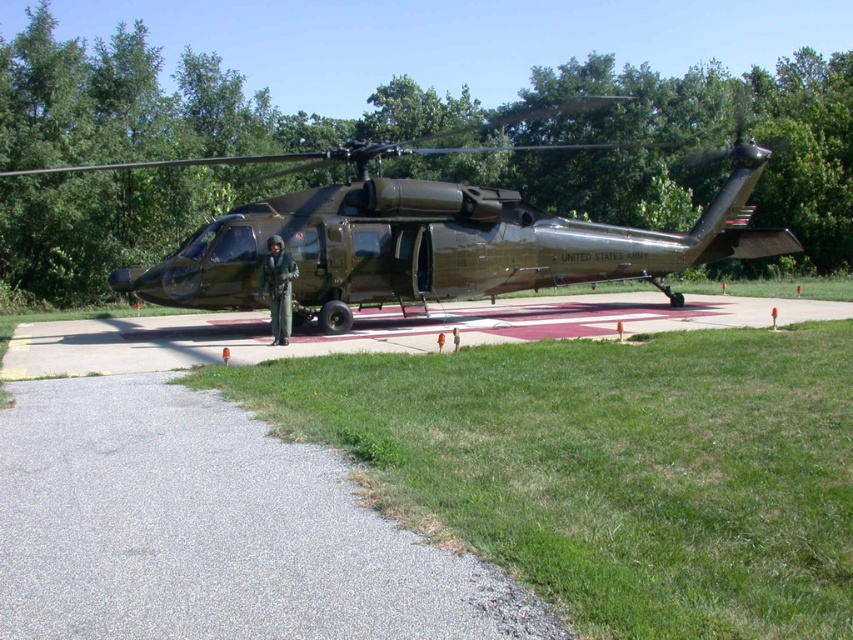
Who is taller, gray asphalt tarmac at lower left or matte black helicopter at center?

matte black helicopter at center is taller.

What do you see at coordinates (212, 531) in the screenshot? The image size is (853, 640). I see `gray asphalt tarmac at lower left` at bounding box center [212, 531].

In order to click on gray asphalt tarmac at lower left in this screenshot , I will do `click(212, 531)`.

Which of these two, gray asphalt tarmac at lower left or camouflage fabric uniform at center, stands shorter?

With less height is gray asphalt tarmac at lower left.

Does point (303, 588) come closer to viewer compared to point (277, 282)?

Yes.

Where is `gray asphalt tarmac at lower left`? gray asphalt tarmac at lower left is located at coordinates (212, 531).

Is point (706, 156) positioned after point (721, 300)?

That is True.

Consider the image. Is matte black helicopter at center bigger than concrete tarmac at center?

Correct, matte black helicopter at center is larger in size than concrete tarmac at center.

At what (x,y) coordinates should I click in order to perform the action: click on matte black helicopter at center. Please return your answer as a coordinate pair (x, y). Image resolution: width=853 pixels, height=640 pixels. Looking at the image, I should click on pyautogui.click(x=433, y=234).

This screenshot has width=853, height=640. Identify the location of matte black helicopter at center. pos(433,234).